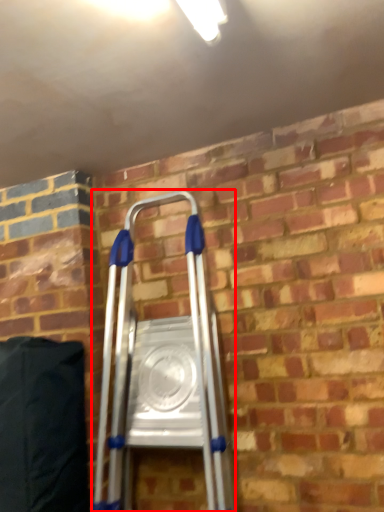
Question: From the image's perspective, what is the correct spatial positioning of ladder (annotated by the red box) in reference to bean bag chair?

Choices:
 (A) above
 (B) below

Answer: (A)